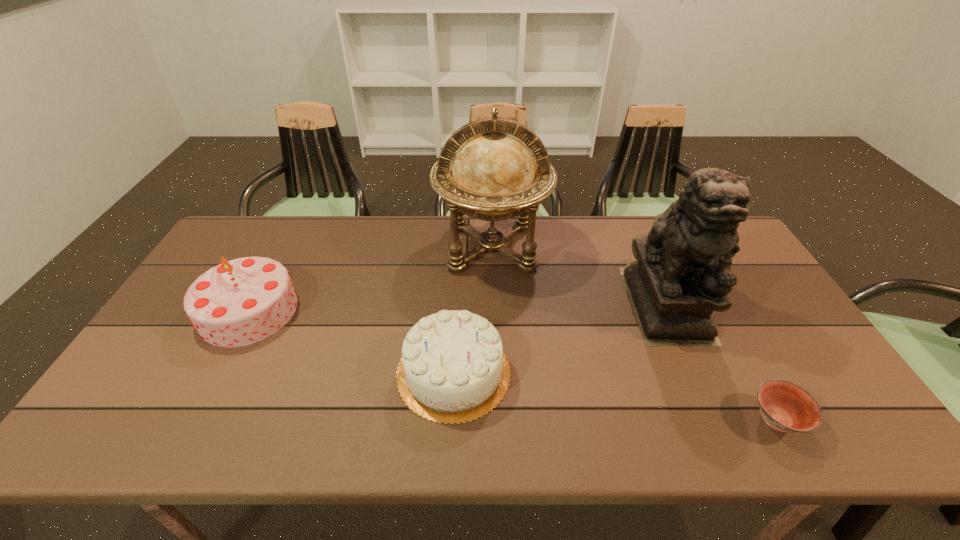
Where is `globe`? globe is located at coordinates (493, 176).

The height and width of the screenshot is (540, 960). I want to click on sculpture, so click(682, 272).

Identify the location of the leftmost object. (242, 301).

Locate an element on the screen. the left birthday cake is located at coordinates (242, 301).

At what (x,y) coordinates should I click in order to perform the action: click on the shorter birthday cake. Please return your answer as a coordinate pair (x, y). This screenshot has width=960, height=540. Looking at the image, I should click on (x=453, y=369).

Locate an element on the screen. Image resolution: width=960 pixels, height=540 pixels. the second shortest object is located at coordinates (453, 369).

Where is `bowl`? The width and height of the screenshot is (960, 540). bowl is located at coordinates (784, 406).

Image resolution: width=960 pixels, height=540 pixels. Identify the location of free spot located 0.270m on the front-facing side of the globe. (495, 356).

This screenshot has width=960, height=540. Find the location of `vacant space located on the front-facing side of the sculpture`. vacant space located on the front-facing side of the sculpture is located at coordinates (708, 400).

Identify the location of blank space located on the front of the taller birthday cake. The height and width of the screenshot is (540, 960). (194, 413).